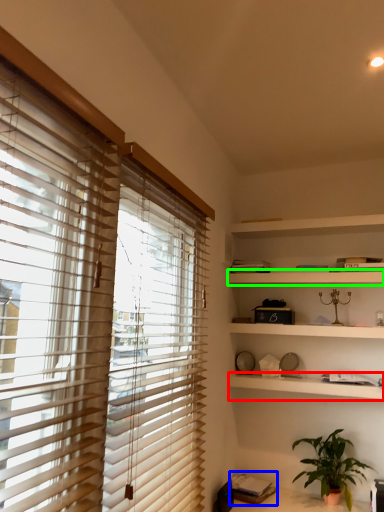
Question: Which object is positioned closest to shelf (highlighted by a red box)? Select from book (highlighted by a blue box) and shelf (highlighted by a green box).

Choices:
 (A) book
 (B) shelf

Answer: (B)